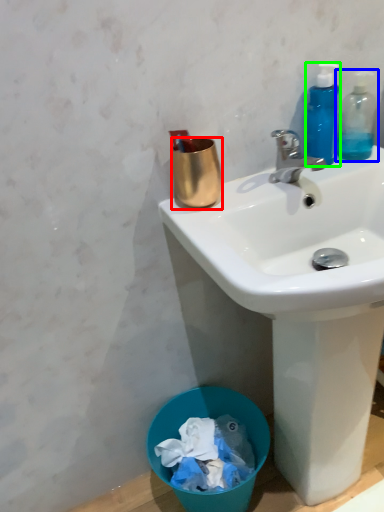
Question: Based on their relative distances, which object is nearer to coffee cup (highlighted by a red box)? Choose from bottle (highlighted by a blue box) and bottle (highlighted by a green box).

Choices:
 (A) bottle
 (B) bottle

Answer: (B)